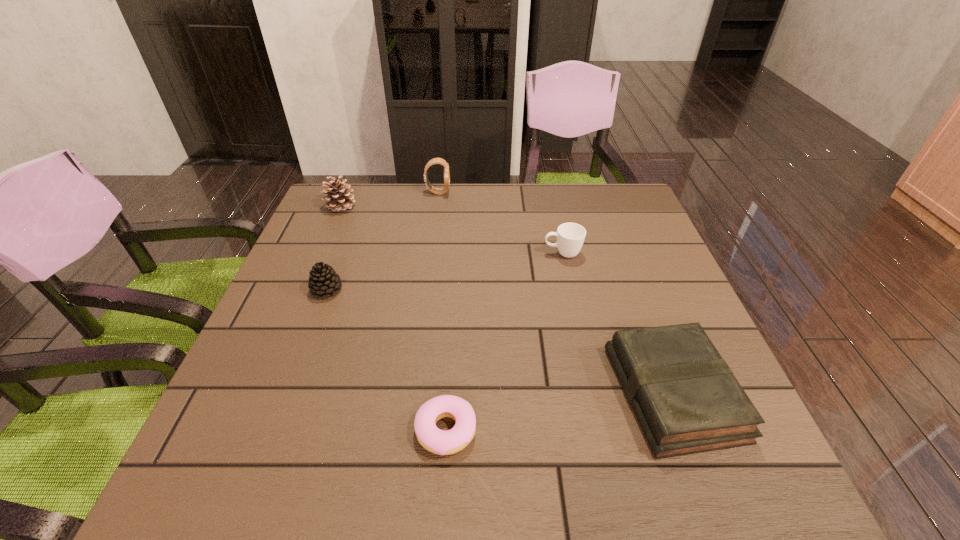
Choose which object is the nearest neighbor to the shortest object. Please provide its 2D coordinates. Your answer should be formatted as a tuple, i.e. [(x, y)], where the tuple contains the x and y coordinates of a point satisfying the conditions above.

[(686, 399)]

Locate an element on the screen. The width and height of the screenshot is (960, 540). vacant space that satisfies the following two spatial constraints: 1. at the narrow end of the third nearest object; 2. on the back side of the book is located at coordinates (288, 393).

Locate an element on the screen. The height and width of the screenshot is (540, 960). vacant space that satisfies the following two spatial constraints: 1. on the face of the farthest object; 2. on the left side of the book is located at coordinates (411, 393).

The height and width of the screenshot is (540, 960). I want to click on free region that satisfies the following two spatial constraints: 1. at the narrow end of the book; 2. on the left side of the nearer pinecone, so click(x=288, y=393).

Identify the location of vacant space that satisfies the following two spatial constraints: 1. at the narrow end of the shorter pinecone; 2. on the back side of the book. This screenshot has height=540, width=960. (288, 393).

At what (x,y) coordinates should I click in order to perform the action: click on free spot that satisfies the following two spatial constraints: 1. on the face of the farthest object; 2. on the back side of the book. Please return your answer as a coordinate pair (x, y). The image size is (960, 540). Looking at the image, I should click on 411,393.

Identify the location of vacant space that satisfies the following two spatial constraints: 1. on the back side of the shortest object; 2. on the left side of the book. (448, 393).